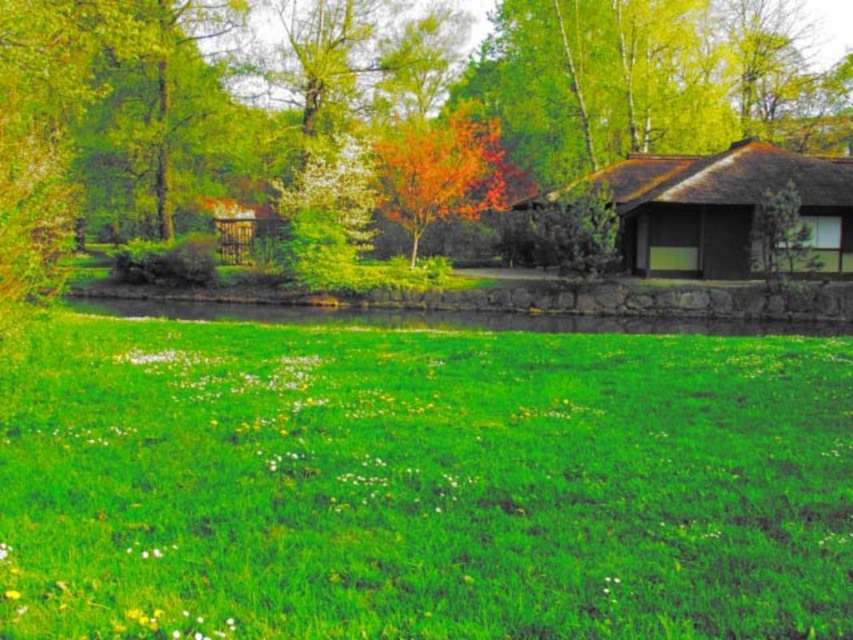
You are standing in the middle of the green grass at center and want to walk towards the autumn leaves tree at center. In which direction should you head?

The green grass at center is positioned on the left side of autumn leaves tree at center, so you should head to the right to reach the autumn leaves tree at center.

You are standing in the serene outdoor scene with the grass, water, and trees. You notice two points marked in the image. The first point is at coordinate point (724, 250) and the second is at point (486, 134). Which of these two points is closer to you?

Point (724, 250) is closer to the viewer than point (486, 134).